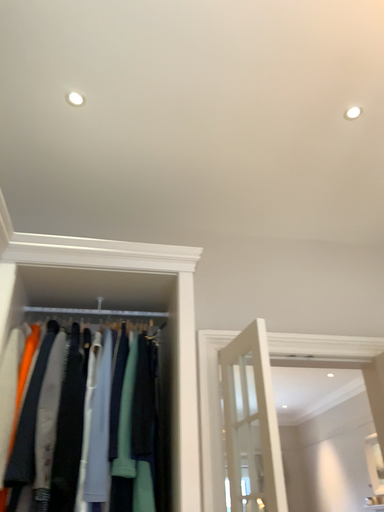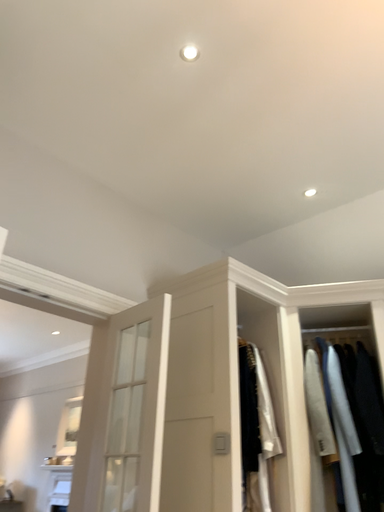
Question: How did the camera likely rotate when shooting the video?

Choices:
 (A) rotated left
 (B) rotated right

Answer: (B)